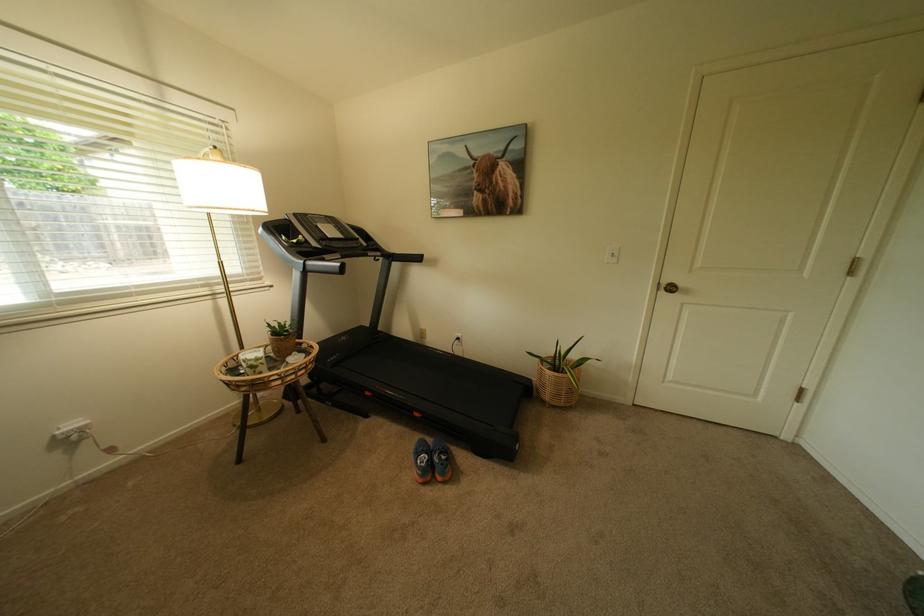
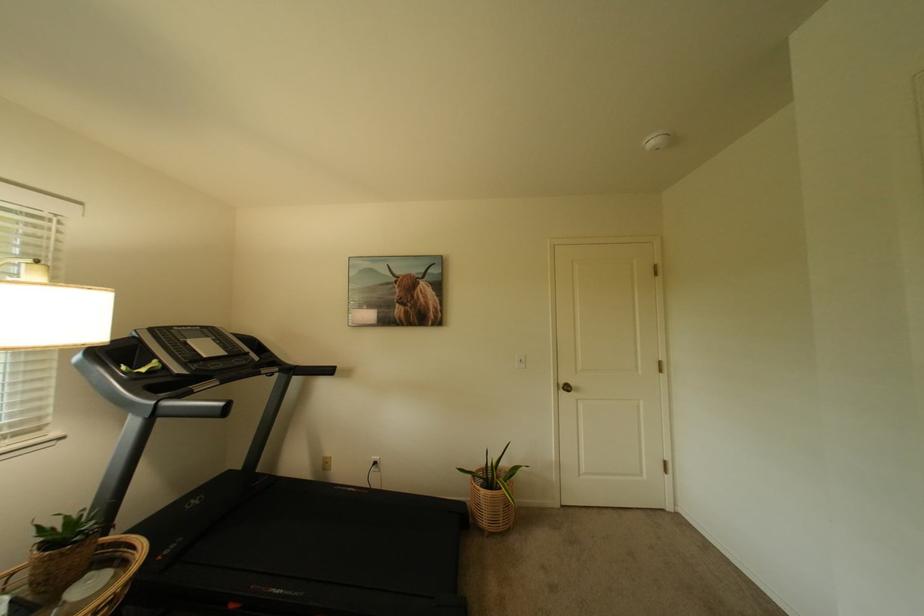
The point at (672, 286) is marked in the first image. Where is the corresponding point in the second image?

(569, 386)